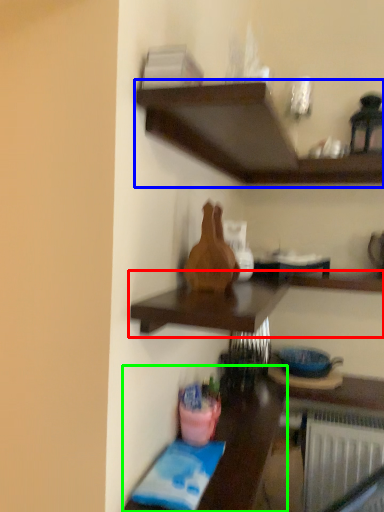
Question: Which object is the farthest from shelf (highlighted by a red box)? Choose among these: shelf (highlighted by a blue box) or table (highlighted by a green box).

Choices:
 (A) shelf
 (B) table

Answer: (A)